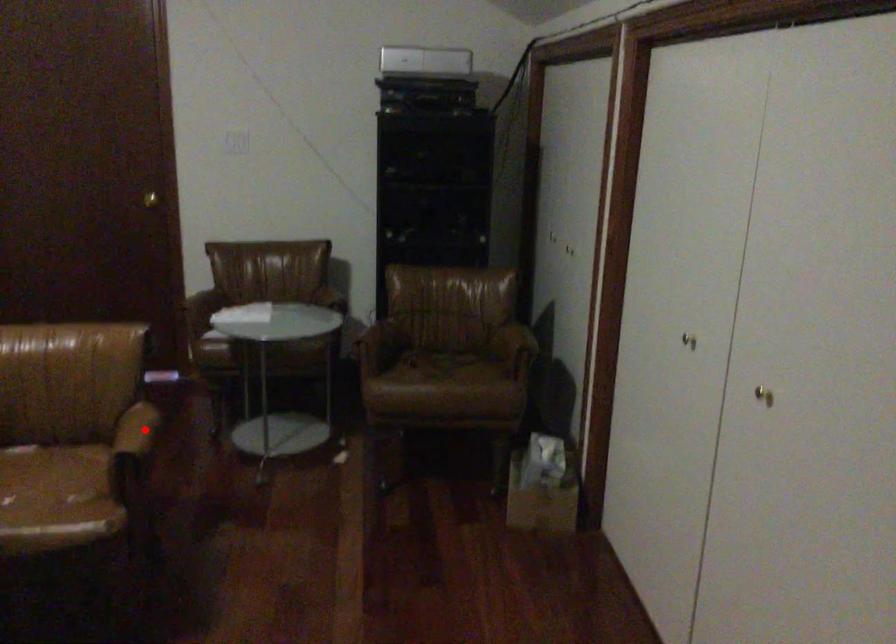
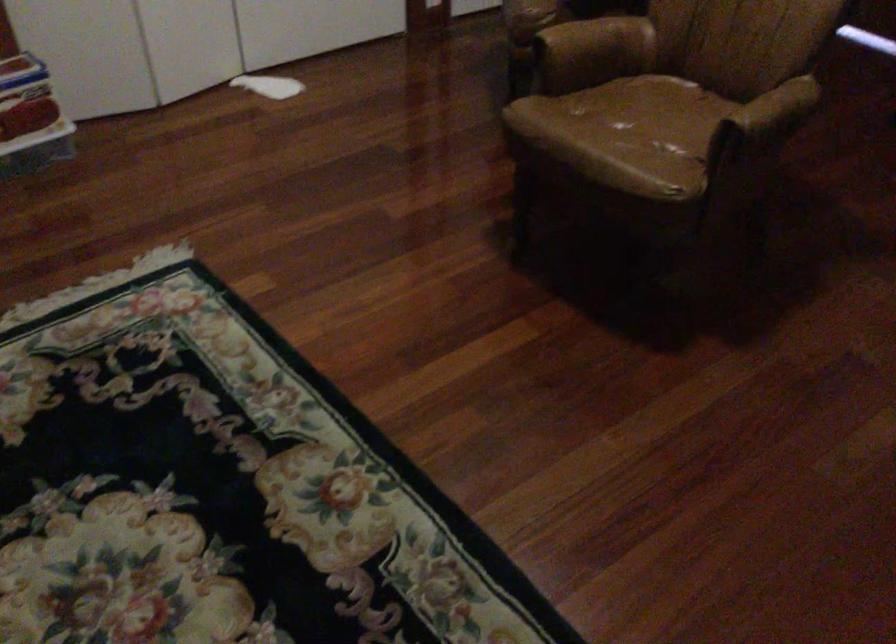
Question: I am providing you with two images of the same scene from different viewpoints. In image1, a red point is highlighted. Considering the same 3D point in image2, which of the following is correct?

Choices:
 (A) It is closer
 (B) It is farther

Answer: (A)